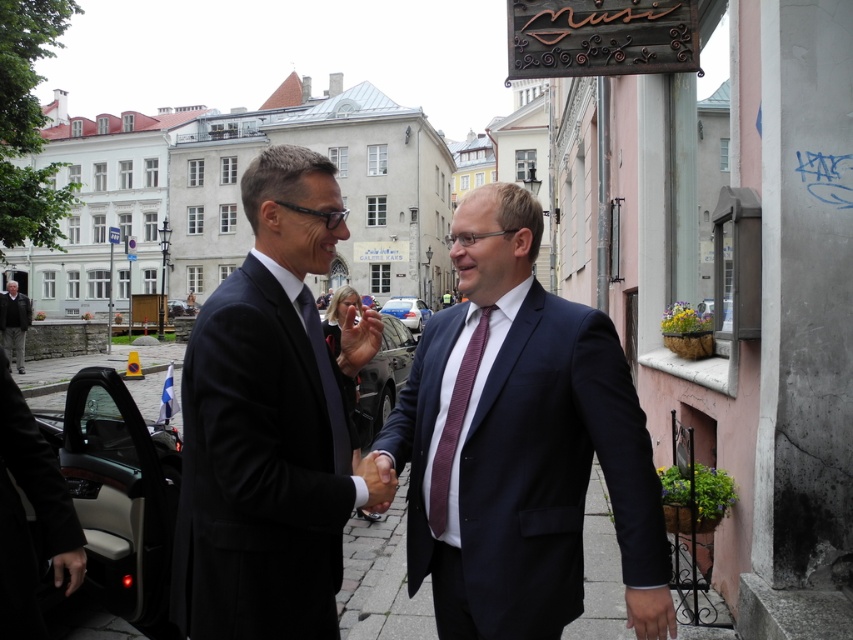
You are a photographer standing on the cobblestone street. You want to take a photo of the dark blue suit at center and the dark gray leather car at lower left. Which object should you focus on first if you want to capture both in the same frame without moving the camera?

The dark blue suit at center is above the dark gray leather car at lower left, so you should focus on the dark blue suit at center first to ensure both are in the frame.

You are a photographer trying to capture a photo of the dark gray suit at lower left and the glossy black car at center. Based on their positions, which object is located to the right of the other?

The glossy black car at center is positioned on the right side of dark gray suit at lower left.